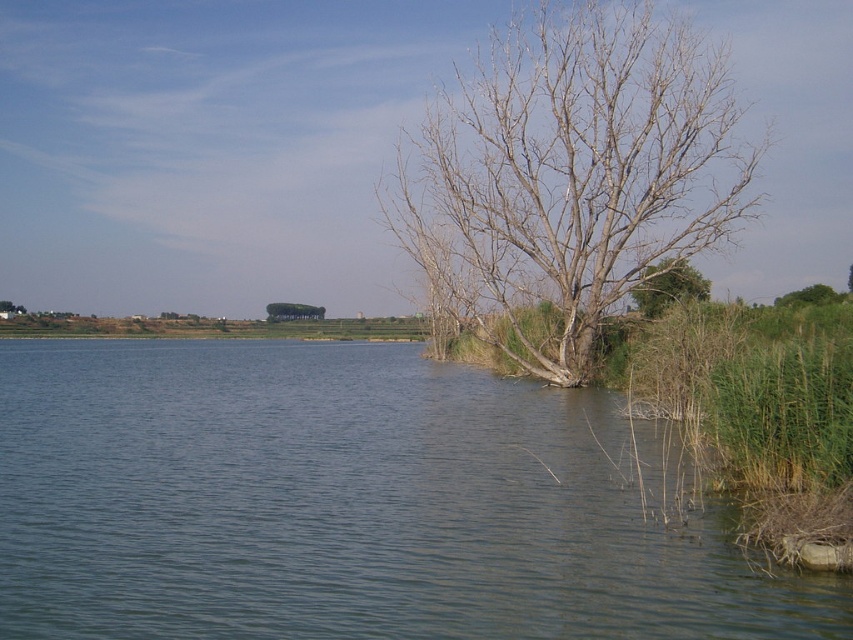
Locate an element on the screen. greenish water at center is located at coordinates (347, 504).

Can you confirm if greenish water at center is bigger than green leafy tree at center?

Correct, greenish water at center is larger in size than green leafy tree at center.

Is point (643, 595) closer to viewer compared to point (287, 317)?

Yes, point (643, 595) is closer to viewer.

You are a GUI agent. You are given a task and a screenshot of the screen. Output one action in this format:
    pyautogui.click(x=<x>, y=<y>)
    Task: Click on the greenish water at center
    This screenshot has width=853, height=640.
    Given the screenshot: What is the action you would take?
    pyautogui.click(x=347, y=504)

Who is higher up, brown rough tree at upper right or green leafy tree at center?

green leafy tree at center is higher up.

Can you confirm if brown rough tree at upper right is thinner than green leafy tree at center?

Indeed, brown rough tree at upper right has a lesser width compared to green leafy tree at center.

Which is behind, point (706, 280) or point (305, 305)?

The point (305, 305) is more distant.

Find the location of a particular element. This screenshot has height=640, width=853. brown rough tree at upper right is located at coordinates (669, 288).

Between point (619, 58) and point (790, 305), which one is positioned in front?

Point (619, 58)

Who is positioned more to the left, bare wood tree at center or green leafy tree at right?

bare wood tree at center is more to the left.

What do you see at coordinates (567, 177) in the screenshot? The width and height of the screenshot is (853, 640). I see `bare wood tree at center` at bounding box center [567, 177].

The width and height of the screenshot is (853, 640). I want to click on bare wood tree at center, so click(567, 177).